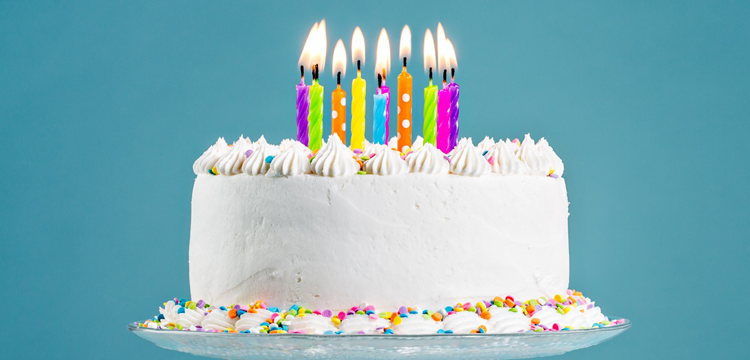
Identify the location of candles. Image resolution: width=750 pixels, height=360 pixels. (301, 101), (315, 119), (334, 103), (357, 92), (380, 118), (388, 90), (402, 91), (428, 110), (444, 115), (457, 94).